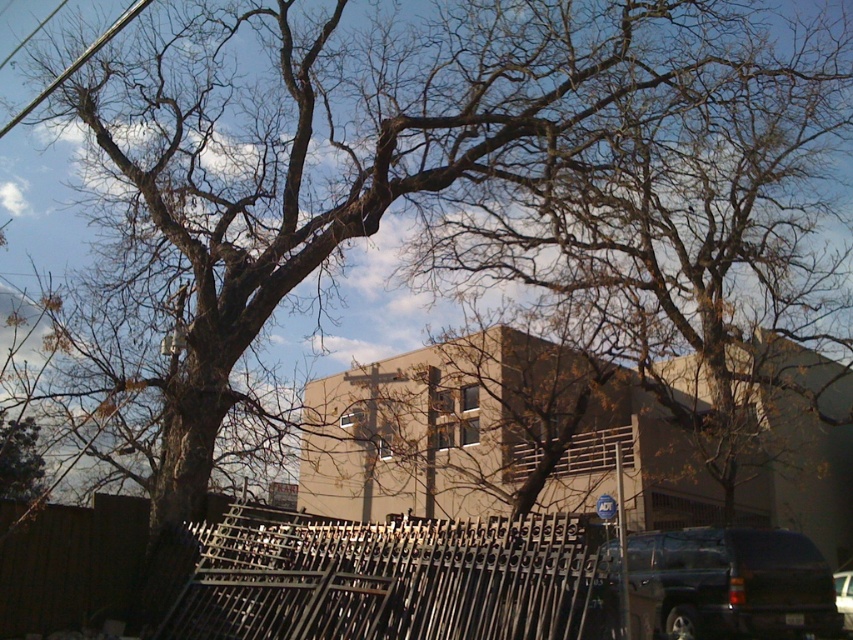
Question: Which of these objects is positioned closest to the matte black suv at lower right?

Choices:
 (A) metallic silver fence at lower center
 (B) metallic wire at upper left
 (C) shiny black suv at lower right

Answer: (C)

Question: Which point appears closest to the camera in this image?

Choices:
 (A) (469, 532)
 (B) (102, 42)

Answer: (A)

Question: Does matte black suv at lower right have a lesser width compared to shiny black suv at lower right?

Choices:
 (A) no
 (B) yes

Answer: (A)

Question: Which point is farther to the camera?

Choices:
 (A) (572, 515)
 (B) (695, 612)
 (C) (44, 99)
 (D) (839, 586)

Answer: (A)

Question: Observing the image, what is the correct spatial positioning of metallic wire at upper left in reference to shiny black suv at lower right?

Choices:
 (A) below
 (B) above

Answer: (B)

Question: Is matte black suv at lower right thinner than metallic wire at upper left?

Choices:
 (A) no
 (B) yes

Answer: (B)